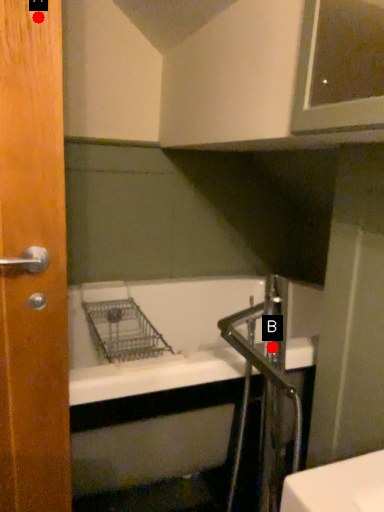
Question: Two points are circled on the image, labeled by A and B beside each circle. Among these points, which one is nearest to the camera?

Choices:
 (A) A is closer
 (B) B is closer

Answer: (A)